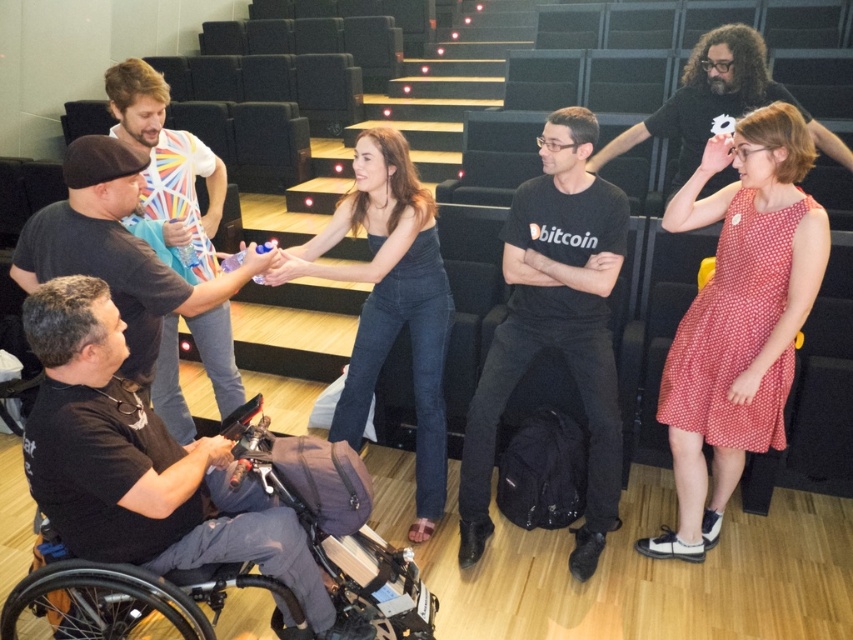
From the picture: You are sitting in the front row of the auditorium and want to look at two points in the image, point (131, 349) and point (704, 131). Which point will appear larger to you?

Point (131, 349) is closer to the viewer than point (704, 131), so it will appear larger.

Based on the photo, you are a photographer setting up for an event in the auditorium. You need to position a spotlight that will illuminate the matte black tank top at center. However, the spotlight can only be placed at the point with coordinates given in the objects list. Is the spotlight placed correctly at point (389, 304) to hit the matte black tank top at center?

Yes, the spotlight placed at point (389, 304) is correctly positioned to illuminate the matte black tank top at center because the coordinates provided directly indicate the location of the matte black tank top at center.

Consider the image. You are standing at the entrance of the auditorium and want to locate the person wearing the red polka dot dress at center. According to the scene description, where should you look to find them?

The red polka dot dress at center is located at point coordinates of 0.495 on the x axis and 0.866 on the y axis, which is near the center of the auditorium.